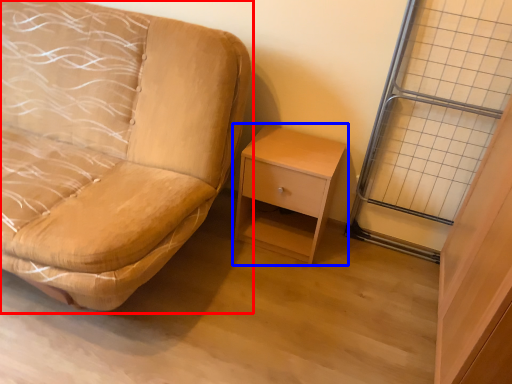
Question: Which object is further to the camera taking this photo, studio couch (highlighted by a red box) or nightstand (highlighted by a blue box)?

Choices:
 (A) studio couch
 (B) nightstand

Answer: (B)